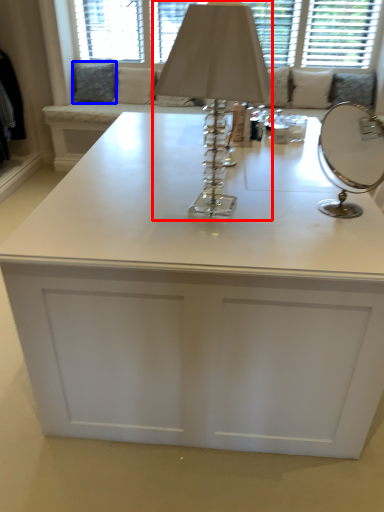
Question: Among these objects, which one is nearest to the camera, table lamp (highlighted by a red box) or pillow (highlighted by a blue box)?

Choices:
 (A) table lamp
 (B) pillow

Answer: (A)